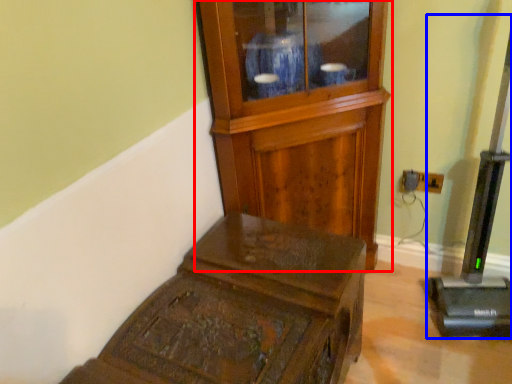
Question: Which point is further to the camera, side cabinet (highlighted by a red box) or equipment (highlighted by a blue box)?

Choices:
 (A) side cabinet
 (B) equipment

Answer: (A)